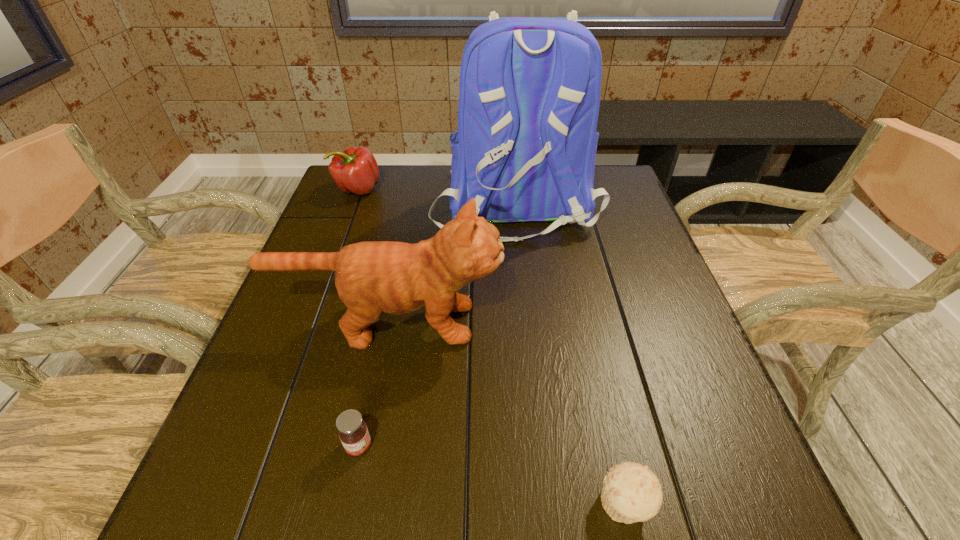
Locate an element on the screen. This screenshot has width=960, height=540. backpack is located at coordinates (525, 148).

At what (x,y) coordinates should I click in order to perform the action: click on the third farthest object. Please return your answer as a coordinate pair (x, y). Image resolution: width=960 pixels, height=540 pixels. Looking at the image, I should click on tap(372, 277).

Where is `the fourth shortest object`? This screenshot has height=540, width=960. the fourth shortest object is located at coordinates (372, 277).

Find the location of a particular element. the third shortest object is located at coordinates (355, 170).

Identify the location of the second nearest object. (353, 432).

This screenshot has width=960, height=540. Identify the location of the nearest object. (631, 492).

In order to click on free spot located 0.060m on the back of the tallest object in this screenshot , I will do `click(520, 269)`.

Identify the location of vacant region located on the face of the fourth shortest object. This screenshot has width=960, height=540. (601, 323).

Where is `free space located 0.170m on the front of the pepper`? free space located 0.170m on the front of the pepper is located at coordinates (340, 240).

I want to click on free space located 0.070m on the label side of the jam, so click(x=347, y=505).